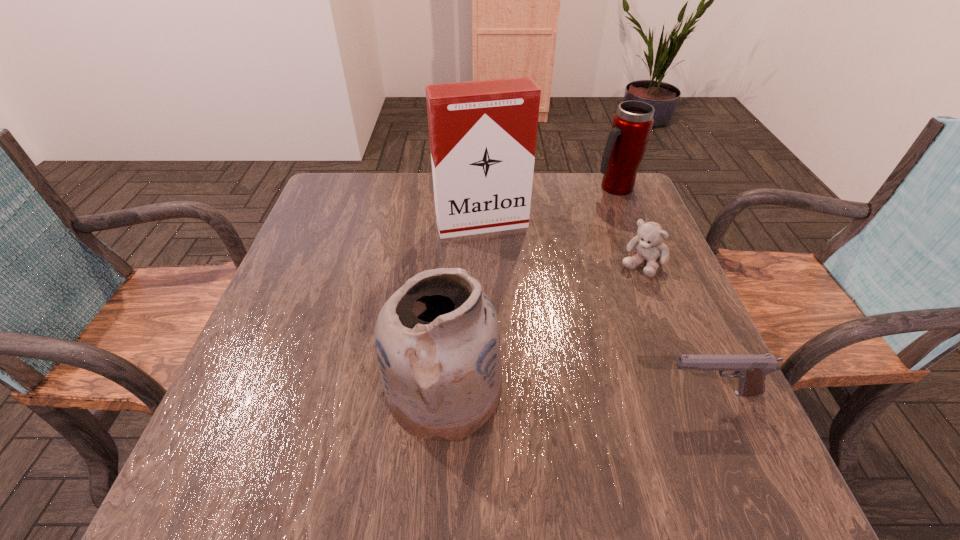
Where is `vacant space at the near edge`? The image size is (960, 540). vacant space at the near edge is located at coordinates (590, 429).

Where is `free spot at the left edge of the desktop`? This screenshot has width=960, height=540. free spot at the left edge of the desktop is located at coordinates (257, 369).

At what (x,y) coordinates should I click in order to perform the action: click on vacant region at the right edge. Please return your answer as a coordinate pair (x, y). Looking at the image, I should click on (634, 292).

At what (x,y) coordinates should I click in order to perform the action: click on vacant region at the near left corner of the desktop. Please return your answer as a coordinate pair (x, y). Looking at the image, I should click on (269, 389).

Image resolution: width=960 pixels, height=540 pixels. I want to click on free space at the far right corner, so click(x=633, y=198).

Image resolution: width=960 pixels, height=540 pixels. In order to click on vacant area that lies between the pistol and the third nearest object in this screenshot , I will do `click(677, 328)`.

Locate an element on the screen. The height and width of the screenshot is (540, 960). empty space that is in between the pottery and the pistol is located at coordinates (578, 392).

Identify the location of free spot between the pistol and the teddy bear. (677, 328).

Identify the location of vacant space that's between the pistol and the fourth nearest object. (597, 308).

At what (x,y) coordinates should I click in order to perform the action: click on free space between the tallest object and the farthest object. Please return your answer as a coordinate pair (x, y). Looking at the image, I should click on (548, 206).